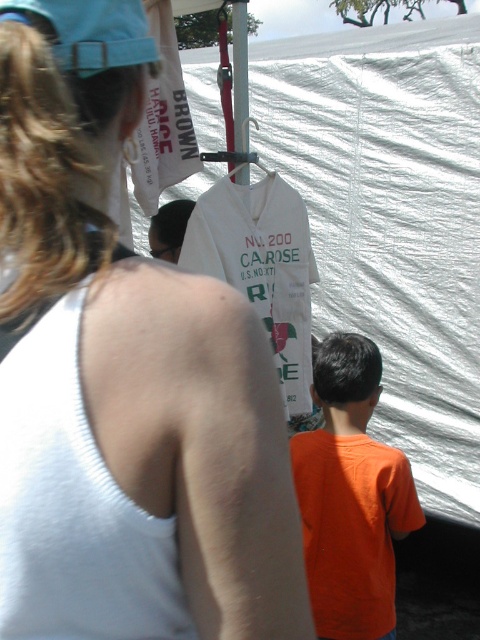
Question: Does white fabric tent at center appear on the left side of orange matte shirt at lower right?

Choices:
 (A) no
 (B) yes

Answer: (A)

Question: Is white fabric tank top at upper left above white fabric tent at center?

Choices:
 (A) yes
 (B) no

Answer: (B)

Question: Which object is positioned closest to the white fabric tent at center?

Choices:
 (A) white fabric tank top at upper left
 (B) white cotton t-shirt at center
 (C) orange matte shirt at lower right

Answer: (C)

Question: Which of the following is the closest to the observer?

Choices:
 (A) orange matte shirt at lower right
 (B) white fabric tent at center
 (C) white fabric tank top at upper left

Answer: (C)

Question: Which object is closer to the camera taking this photo?

Choices:
 (A) white fabric tank top at upper left
 (B) orange matte shirt at lower right
 (C) white fabric tent at center

Answer: (A)

Question: Is white fabric tank top at upper left bigger than orange matte shirt at lower right?

Choices:
 (A) yes
 (B) no

Answer: (B)